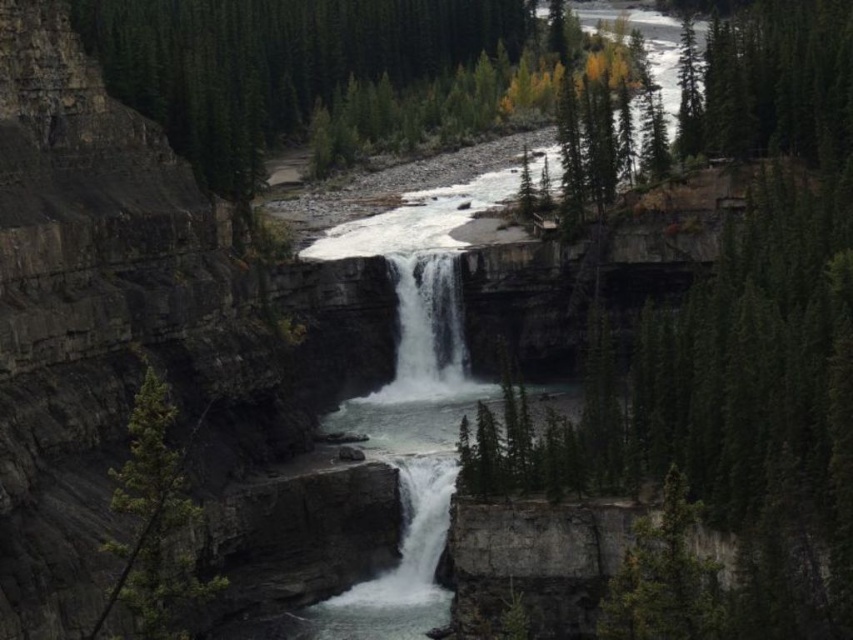
Locate an element on the screen. This screenshot has height=640, width=853. green textured tree at left is located at coordinates (154, 524).

Is point (149, 474) closer to viewer compared to point (424, 365)?

That is True.

Who is more distant from viewer, (155, 609) or (415, 378)?

The point (415, 378) is behind.

At what (x,y) coordinates should I click in order to perform the action: click on green textured tree at left. Please return your answer as a coordinate pair (x, y). The image size is (853, 640). Looking at the image, I should click on (154, 524).